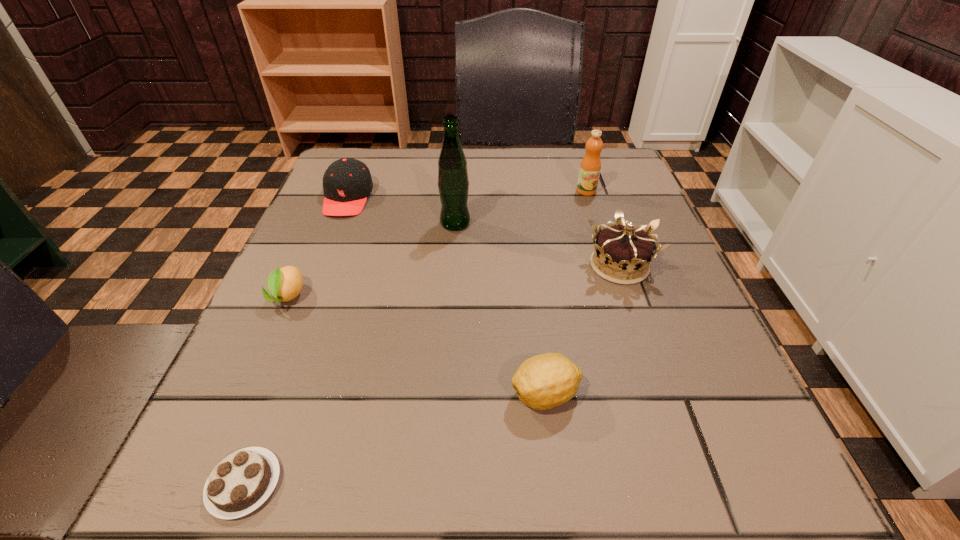
Locate an element on the screen. beer bottle is located at coordinates (453, 184).

Identify the location of the tallest object. (453, 184).

Find the location of `orange juice`. orange juice is located at coordinates (590, 167).

Locate an element on the screen. This screenshot has height=540, width=960. crown is located at coordinates (620, 249).

Find the location of a particular element. The image size is (960, 540). cap is located at coordinates pyautogui.click(x=347, y=182).

Where is `the right lemon`? the right lemon is located at coordinates (544, 381).

Image resolution: width=960 pixels, height=540 pixels. In order to click on the nearer lemon in this screenshot , I will do `click(544, 381)`.

This screenshot has height=540, width=960. What are the coordinates of `the farther lemon` in the screenshot? It's located at (285, 284).

Find the location of a particular element. The height and width of the screenshot is (540, 960). the left lemon is located at coordinates 285,284.

You are a GUI agent. You are given a task and a screenshot of the screen. Output one action in this format:
    pyautogui.click(x=<x>, y=<y>)
    Task: Click on the shortest object
    
    Given the screenshot: What is the action you would take?
    point(239,484)